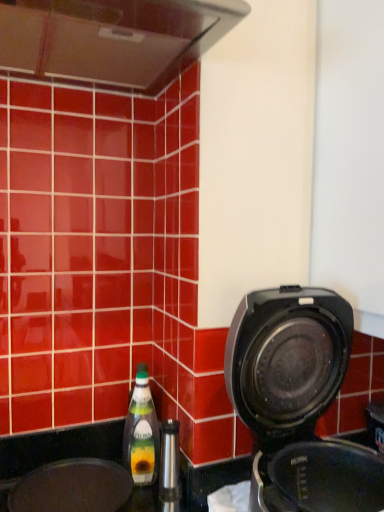
Image resolution: width=384 pixels, height=512 pixels. Describe the element at coordinates (141, 432) in the screenshot. I see `green glass bottle at lower left` at that location.

Describe the element at coordinates (297, 401) in the screenshot. I see `black plastic coffee maker at right` at that location.

This screenshot has width=384, height=512. I want to click on black matte sink at lower left, so click(60, 447).

In terms of height, does black plastic coffee maker at right look taller or shorter compared to black matte sink at lower left?

Considering their sizes, black plastic coffee maker at right has more height than black matte sink at lower left.

Which object is closer to the camera taking this photo, black plastic coffee maker at right or black matte sink at lower left?

black plastic coffee maker at right is in front.

You are a GUI agent. You are given a task and a screenshot of the screen. Output one action in this format:
    pyautogui.click(x=<x>, y=<y>)
    Task: Click on the home appliance on the right of black matte sink at lower left
    The height and width of the screenshot is (512, 384).
    Given the screenshot: What is the action you would take?
    pyautogui.click(x=297, y=401)

From the picture: Is black plastic coffee maker at right oriented towards black matte sink at lower left?

No, black plastic coffee maker at right is not aimed at black matte sink at lower left.

Consider the image. Is green glass bottle at lower left facing towards black matte sink at lower left?

No, green glass bottle at lower left is not oriented towards black matte sink at lower left.

Considering the sizes of objects green glass bottle at lower left and black matte sink at lower left in the image provided, who is wider, green glass bottle at lower left or black matte sink at lower left?

Wider between the two is black matte sink at lower left.

Is green glass bottle at lower left far from black matte sink at lower left?

No, there isn't a large distance between green glass bottle at lower left and black matte sink at lower left.

From a real-world perspective, is green glass bottle at lower left positioned over black matte sink at lower left based on gravity?

Indeed, from a real-world perspective, green glass bottle at lower left stands above black matte sink at lower left.

Would you say black plastic coffee maker at right is part of black matte sink at lower left's contents?

Actually, black plastic coffee maker at right is outside black matte sink at lower left.

Who is bigger, black matte sink at lower left or black plastic coffee maker at right?

black plastic coffee maker at right.

Is black matte sink at lower left directly adjacent to black plastic coffee maker at right?

No, black matte sink at lower left is not beside black plastic coffee maker at right.

From the image's perspective, between black matte sink at lower left and green glass bottle at lower left, who is located below?

black matte sink at lower left is shown below in the image.

Can you confirm if black matte sink at lower left is shorter than green glass bottle at lower left?

Indeed, black matte sink at lower left has a lesser height compared to green glass bottle at lower left.

Between black matte sink at lower left and green glass bottle at lower left, which one has larger width?

With larger width is black matte sink at lower left.

Identify the location of sink that appears below the green glass bottle at lower left (from a real-world perspective). The image size is (384, 512). (60, 447).

Is black plastic coffee maker at right positioned with its back to green glass bottle at lower left?

Yes, black plastic coffee maker at right is positioned with its back facing green glass bottle at lower left.

Who is shorter, black plastic coffee maker at right or green glass bottle at lower left?

Standing shorter between the two is green glass bottle at lower left.

Is the surface of black plastic coffee maker at right in direct contact with green glass bottle at lower left?

No, black plastic coffee maker at right is not making contact with green glass bottle at lower left.

How many degrees apart are the facing directions of black plastic coffee maker at right and green glass bottle at lower left?

black plastic coffee maker at right and green glass bottle at lower left are facing 0.00763 degrees away from each other.

From the picture: Considering the relative positions of green glass bottle at lower left and black plastic coffee maker at right in the image provided, is green glass bottle at lower left to the left or to the right of black plastic coffee maker at right?

green glass bottle at lower left is to the left of black plastic coffee maker at right.

Considering their positions, is green glass bottle at lower left located in front of or behind black plastic coffee maker at right?

green glass bottle at lower left is behind black plastic coffee maker at right.

Between point (152, 426) and point (336, 459), which one is positioned behind?

The point (152, 426) is farther from the camera.

From a real-world perspective, is green glass bottle at lower left on top of black plastic coffee maker at right?

No, from a real-world perspective, green glass bottle at lower left is not above black plastic coffee maker at right.

The height and width of the screenshot is (512, 384). I want to click on sink behind the black plastic coffee maker at right, so click(60, 447).

The height and width of the screenshot is (512, 384). I want to click on sink below the green glass bottle at lower left (from the image's perspective), so click(x=60, y=447).

Looking at the image, which one is located closer to black plastic coffee maker at right, green glass bottle at lower left or black matte sink at lower left?

Based on the image, black matte sink at lower left appears to be nearer to black plastic coffee maker at right.

Looking at the image, which one is located further to black plastic coffee maker at right, black matte sink at lower left or green glass bottle at lower left?

Based on the image, green glass bottle at lower left appears to be further to black plastic coffee maker at right.

When comparing their distances from green glass bottle at lower left, does black plastic coffee maker at right or black matte sink at lower left seem further?

Among the two, black plastic coffee maker at right is located further to green glass bottle at lower left.

Estimate the real-world distances between objects in this image. Which object is closer to black matte sink at lower left, green glass bottle at lower left or black plastic coffee maker at right?

green glass bottle at lower left lies closer to black matte sink at lower left than the other object.

From the image, which object appears to be nearer to black matte sink at lower left, black plastic coffee maker at right or green glass bottle at lower left?

green glass bottle at lower left is closer to black matte sink at lower left.

From the picture: Estimate the real-world distances between objects in this image. Which object is closer to green glass bottle at lower left, black matte sink at lower left or black plastic coffee maker at right?

black matte sink at lower left lies closer to green glass bottle at lower left than the other object.

I want to click on sink between black plastic coffee maker at right and green glass bottle at lower left in the front-back direction, so click(x=60, y=447).